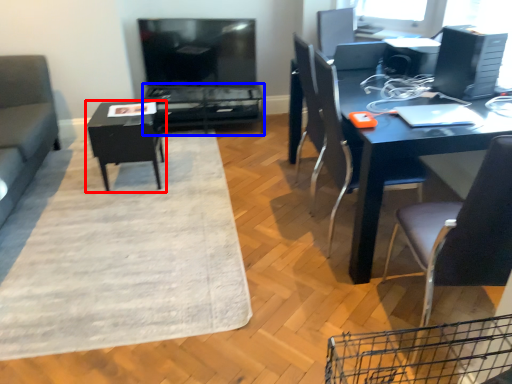
Question: Which of the following is the farthest to the observer, table (highlighted by a red box) or table (highlighted by a blue box)?

Choices:
 (A) table
 (B) table

Answer: (B)